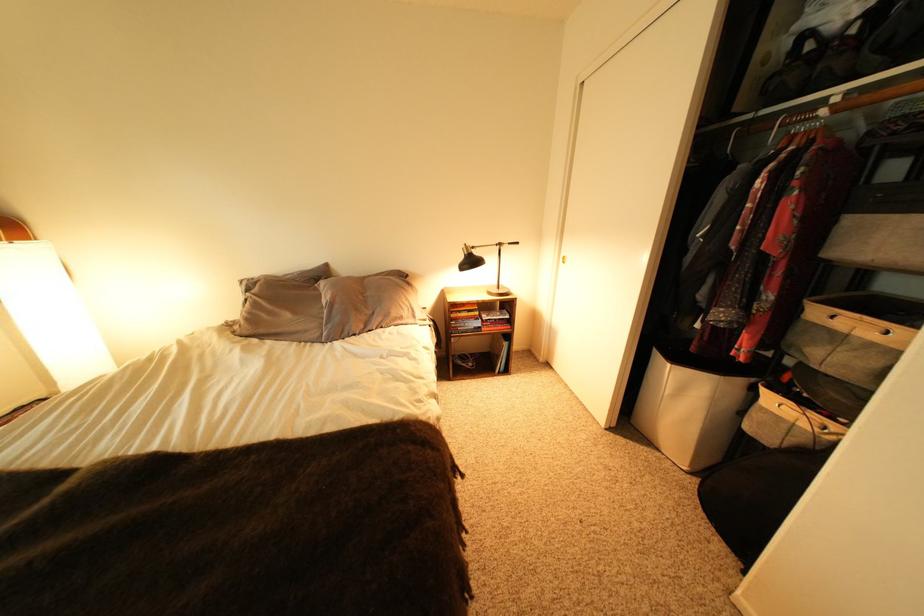
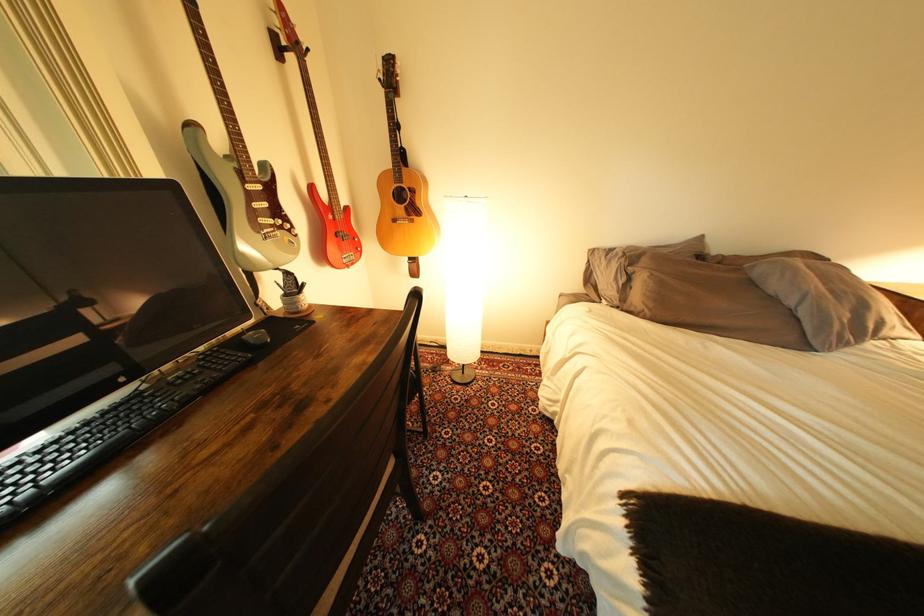
The point at (x=332, y=286) is marked in the first image. Where is the corresponding point in the second image?

(767, 268)